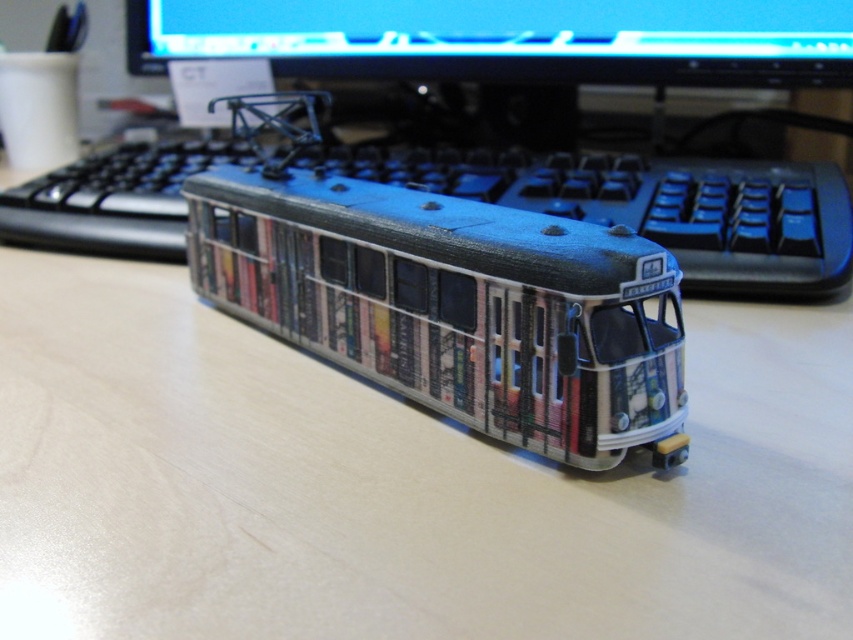
Is metallic silver tram at center positioned at the back of matte black monitor at upper center?

No.

Is point (650, 372) positioned before point (456, 29)?

That is True.

You are a GUI agent. You are given a task and a screenshot of the screen. Output one action in this format:
    pyautogui.click(x=<x>, y=<y>)
    Task: Click on the metallic silver tram at center
    The image size is (853, 640).
    Given the screenshot: What is the action you would take?
    pyautogui.click(x=456, y=305)

Does metallic silver tram at center appear over blue plastic keyboard at center?

No.

Consider the image. Which is more to the left, metallic silver tram at center or blue plastic keyboard at center?

From the viewer's perspective, metallic silver tram at center appears more on the left side.

Is point (558, 285) positioned after point (717, 204)?

No.

I want to click on metallic silver tram at center, so click(456, 305).

Measure the distance from blue plastic keyboard at center to matte black monitor at upper center.

blue plastic keyboard at center is 27.75 centimeters away from matte black monitor at upper center.

Is blue plastic keyboard at center above matte black monitor at upper center?

No.

You are a GUI agent. You are given a task and a screenshot of the screen. Output one action in this format:
    pyautogui.click(x=<x>, y=<y>)
    Task: Click on the blue plastic keyboard at center
    The image size is (853, 640).
    Given the screenshot: What is the action you would take?
    pyautogui.click(x=654, y=205)